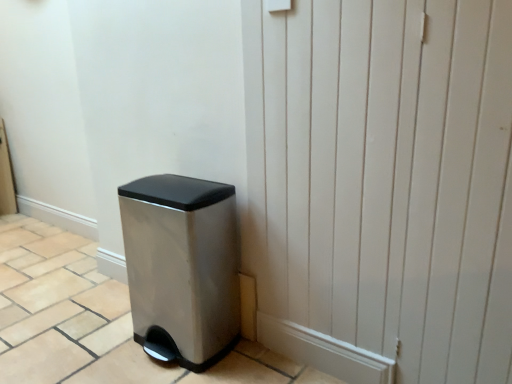
Question: Looking at the image, does white wood screen door at lower right seem bigger or smaller compared to satin silver trash can at lower left?

Choices:
 (A) big
 (B) small

Answer: (B)

Question: From the image's perspective, is white wood screen door at lower right positioned above or below satin silver trash can at lower left?

Choices:
 (A) above
 (B) below

Answer: (A)

Question: Choose the correct answer: Is white wood screen door at lower right inside satin silver trash can at lower left or outside it?

Choices:
 (A) inside
 (B) outside

Answer: (B)

Question: Is satin silver trash can at lower left spatially inside white wood screen door at lower right, or outside of it?

Choices:
 (A) inside
 (B) outside

Answer: (B)

Question: In the image, is satin silver trash can at lower left positioned in front of or behind white wood screen door at lower right?

Choices:
 (A) behind
 (B) front

Answer: (A)

Question: From a real-world perspective, is satin silver trash can at lower left physically located above or below white wood screen door at lower right?

Choices:
 (A) above
 (B) below

Answer: (B)

Question: From the image's perspective, is satin silver trash can at lower left located above or below white wood screen door at lower right?

Choices:
 (A) above
 (B) below

Answer: (B)